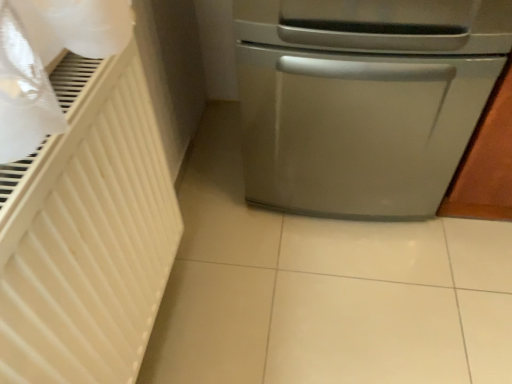
This screenshot has height=384, width=512. Find the location of `free spot in front of satin silver dishwasher at right`. free spot in front of satin silver dishwasher at right is located at coordinates (354, 290).